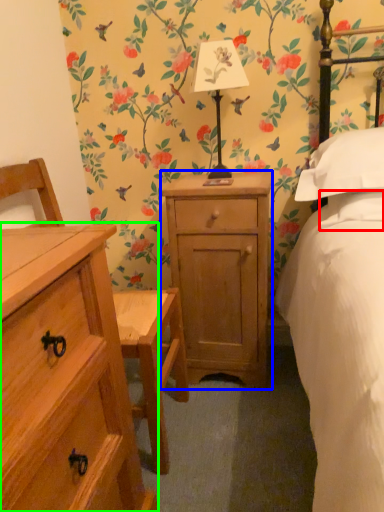
Question: Based on their relative distances, which object is nearer to pillow (highlighted by a red box)? Choose from nightstand (highlighted by a blue box) and chest of drawers (highlighted by a green box).

Choices:
 (A) nightstand
 (B) chest of drawers

Answer: (A)